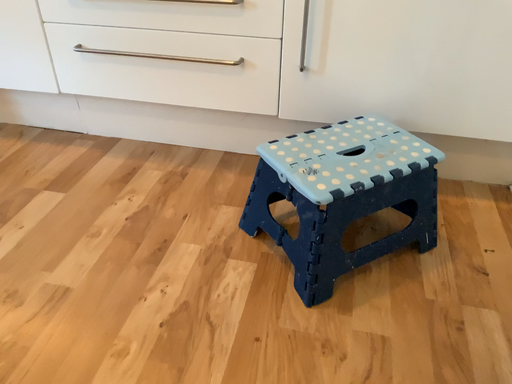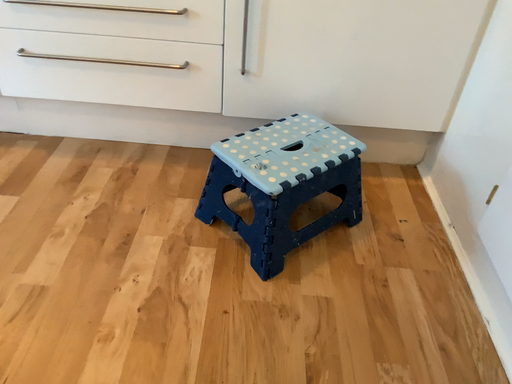
Question: How did the camera likely rotate when shooting the video?

Choices:
 (A) rotated right
 (B) rotated left

Answer: (A)